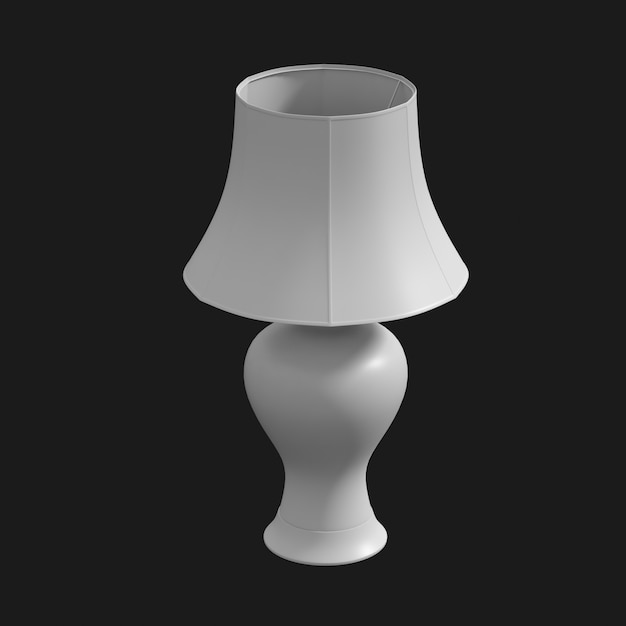
You are a GUI agent. You are given a task and a screenshot of the screen. Output one action in this format:
    pyautogui.click(x=<x>, y=<y>)
    Task: Click on the rim of lampshade
    The width and height of the screenshot is (626, 626).
    Given the screenshot: What is the action you would take?
    pyautogui.click(x=330, y=320), pyautogui.click(x=201, y=298), pyautogui.click(x=183, y=272), pyautogui.click(x=456, y=290), pyautogui.click(x=468, y=269)